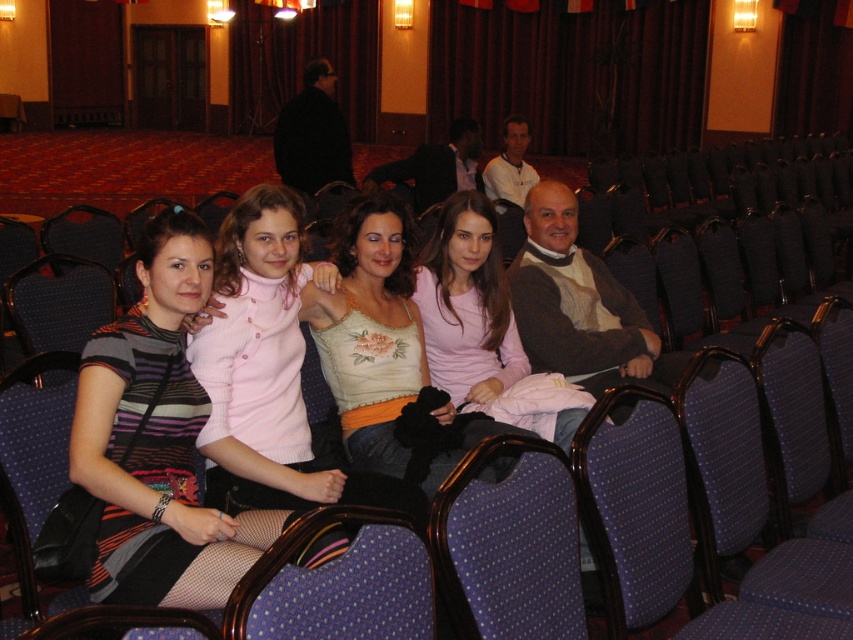
You are organizing a photoshoot and need to ensure that the striped fabric dress at center and the blue dotted fabric chair at center are both visible in the frame. Given their sizes, which object will require more space in the composition?

The striped fabric dress at center has a larger size compared to the blue dotted fabric chair at center, so it will require more space in the composition.

You are sitting in the conference room and need to locate the pink knitted sweater at center. According to the coordinate system where the bottom left corner is the origin, can you tell me its exact location?

The pink knitted sweater at center is located at coordinate point [260,349].